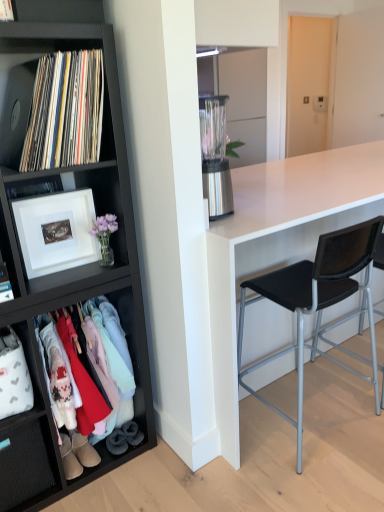
The width and height of the screenshot is (384, 512). In order to click on free space in front of leather boot at lower left, which is the first footwear from left to right in this screenshot , I will do `click(59, 496)`.